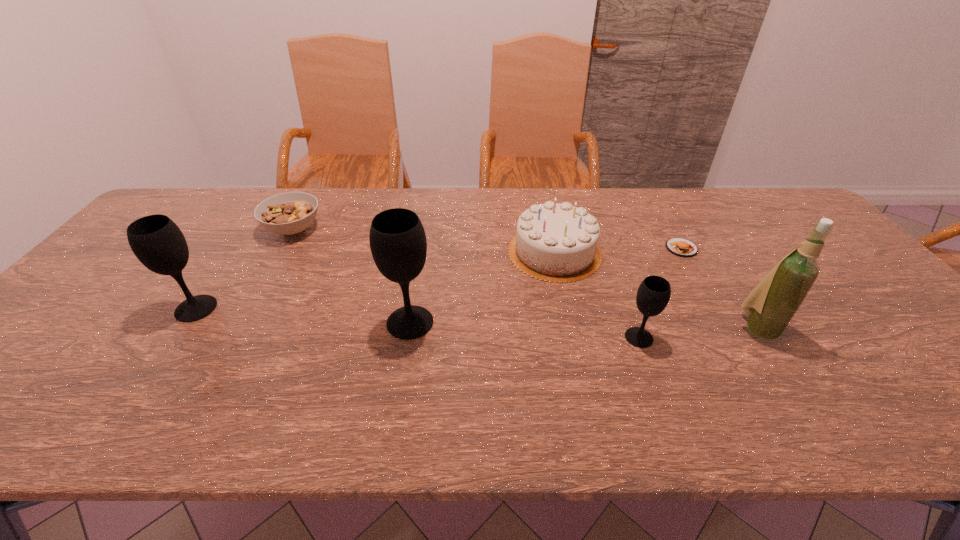
The image size is (960, 540). I want to click on vacant region at the far left corner of the desktop, so click(x=172, y=218).

What are the coordinates of `free space at the far right corner of the desktop` in the screenshot? It's located at pyautogui.click(x=776, y=201).

Identify the location of empty location between the wine bottle and the stew. The image size is (960, 540). (525, 279).

Where is `vacant area that lies between the wine bottle and the shortest object`? Image resolution: width=960 pixels, height=540 pixels. vacant area that lies between the wine bottle and the shortest object is located at coordinates (719, 288).

I want to click on vacant space in between the birthday cake and the rightmost wineglass, so click(597, 295).

Identify the location of vacant space that's between the wine bottle and the sixth tallest object. (525, 279).

This screenshot has height=540, width=960. Identify the location of empty space that is in between the second shortest object and the shortest wineglass. (467, 284).

This screenshot has height=540, width=960. In order to click on unoccupied area between the birthday cake and the third object from left to right in this screenshot , I will do `click(482, 287)`.

Where is `unoccupied position between the second shortest wineglass and the second shortest object`? This screenshot has height=540, width=960. unoccupied position between the second shortest wineglass and the second shortest object is located at coordinates (245, 269).

The image size is (960, 540). Find the location of `free space that is in between the birthday cake and the third object from left to right`. free space that is in between the birthday cake and the third object from left to right is located at coordinates (482, 287).